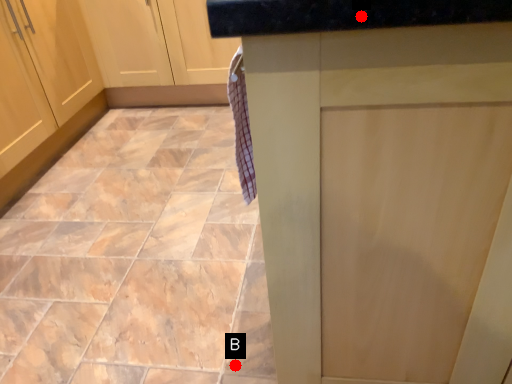
Question: Two points are circled on the image, labeled by A and B beside each circle. Which point is closer to the camera?

Choices:
 (A) A is closer
 (B) B is closer

Answer: (A)